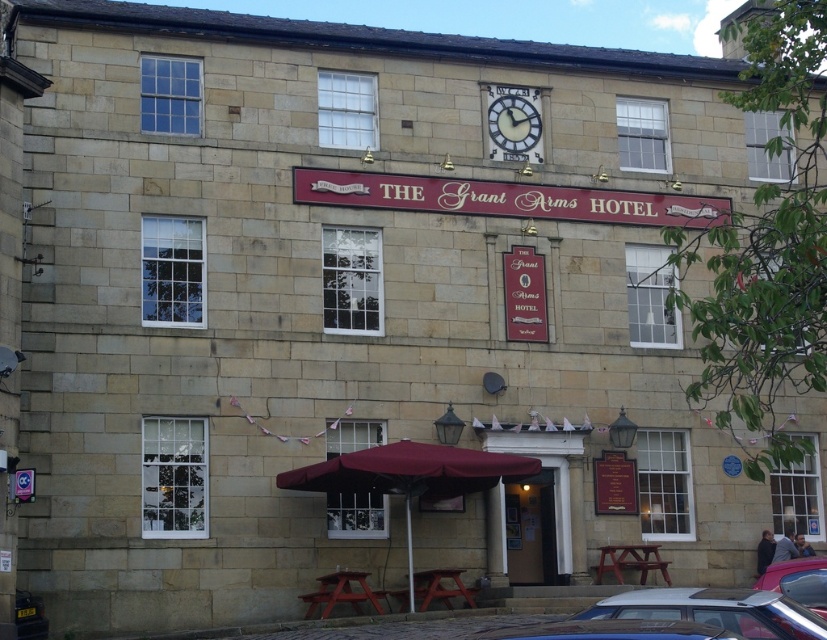
Is metallic silver car at lower center bigger than shiny silver car at lower right?

Incorrect, metallic silver car at lower center is not larger than shiny silver car at lower right.

How distant is metallic silver car at lower center from shiny silver car at lower right?

They are 9.52 meters apart.

The image size is (827, 640). What are the coordinates of `metallic silver car at lower center` in the screenshot? It's located at (606, 630).

Locate an element on the screen. The width and height of the screenshot is (827, 640). metallic silver car at lower center is located at coordinates (606, 630).

Is shiny silver car at lower right further to camera compared to white painted clock face at center?

No, it is in front of white painted clock face at center.

Between point (806, 572) and point (539, 131), which one is positioned behind?

The point (539, 131) is behind.

Image resolution: width=827 pixels, height=640 pixels. Identify the location of shiny silver car at lower right. (797, 580).

Is metallic blue car at lower center wider than shiny silver car at lower right?

Yes, metallic blue car at lower center is wider than shiny silver car at lower right.

Between metallic blue car at lower center and shiny silver car at lower right, which one appears on the left side from the viewer's perspective?

Positioned to the left is metallic blue car at lower center.

Is point (782, 636) more distant than point (784, 572)?

No.

Identify the location of metallic blue car at lower center. (715, 611).